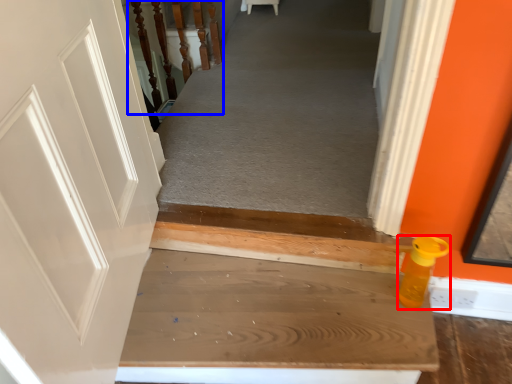
Question: Which point is further to the camera, bottle (highlighted by a red box) or rail (highlighted by a blue box)?

Choices:
 (A) bottle
 (B) rail

Answer: (B)